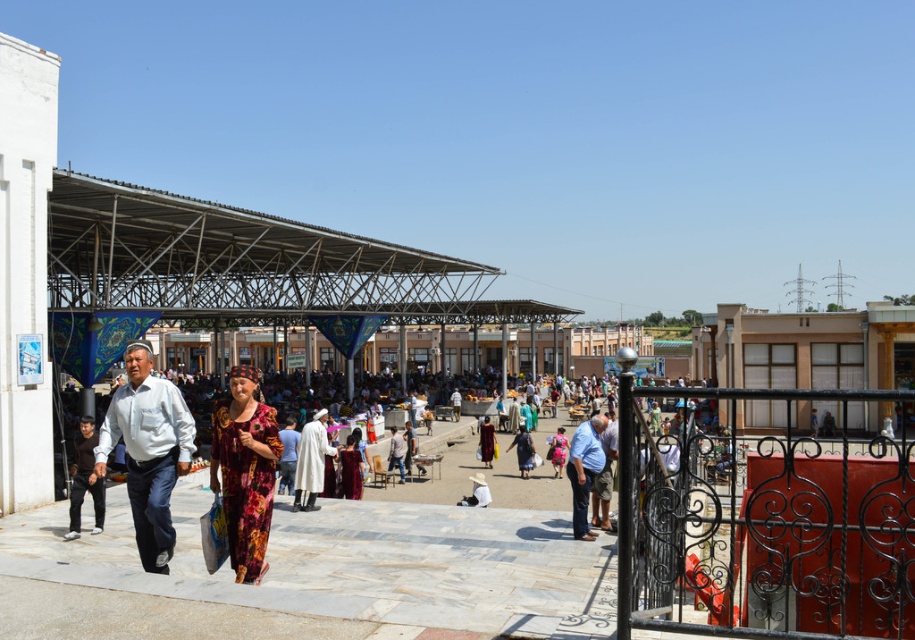
Which is above, blue jeans at center or light brown fabric dress at center?

blue jeans at center

Is the position of blue jeans at center more distant than that of light brown fabric dress at center?

No, it is in front of light brown fabric dress at center.

Describe the element at coordinates (584, 470) in the screenshot. I see `blue jeans at center` at that location.

Where is `blue jeans at center`? blue jeans at center is located at coordinates (584, 470).

Does blue jeans at center have a larger size compared to white fabric hat at center?

Yes, blue jeans at center is bigger than white fabric hat at center.

Does blue jeans at center have a smaller size compared to white fabric hat at center?

Incorrect, blue jeans at center is not smaller in size than white fabric hat at center.

Locate an element on the screen. The image size is (915, 640). blue jeans at center is located at coordinates (584, 470).

Describe the element at coordinates (311, 461) in the screenshot. The width and height of the screenshot is (915, 640). I see `white cotton robe at center` at that location.

Does point (316, 490) come behind point (483, 417)?

No, it is not.

Which is behind, point (318, 465) or point (485, 464)?

The point (485, 464) is more distant.

This screenshot has width=915, height=640. What are the coordinates of `white cotton robe at center` in the screenshot? It's located at (311, 461).